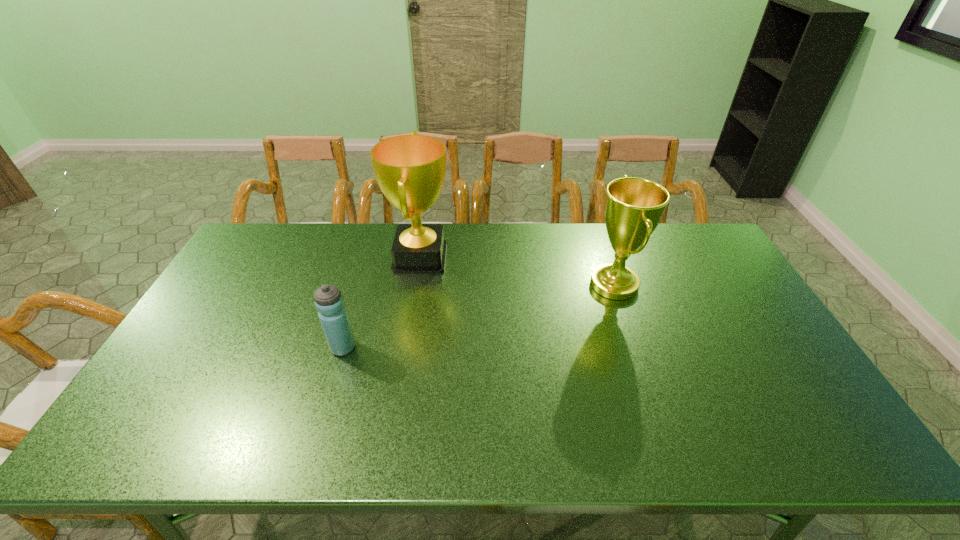
You are a GUI agent. You are given a task and a screenshot of the screen. Output one action in this format:
    pyautogui.click(x=<x>, y=<y>)
    Task: Click on the free space that is in between the shorter award and the nearest object
    
    Given the screenshot: What is the action you would take?
    pyautogui.click(x=478, y=316)

This screenshot has height=540, width=960. Find the location of `free area in between the right award and the leftmost object`. free area in between the right award and the leftmost object is located at coordinates coord(478,316).

The image size is (960, 540). Find the location of `empty space that is in between the water bottle and the shorter award`. empty space that is in between the water bottle and the shorter award is located at coordinates (478, 316).

At what (x,y) coordinates should I click in order to perform the action: click on vacant space in between the leftmost object and the second tallest object. Please return your answer as a coordinate pair (x, y). Looking at the image, I should click on (478, 316).

The image size is (960, 540). What are the coordinates of `blank region between the right award and the shortest object` in the screenshot? It's located at (478, 316).

Identify which object is the second nearest to the shortest object. Please provide its 2D coordinates. Your answer should be formatted as a tuple, i.e. [(x, y)], where the tuple contains the x and y coordinates of a point satisfying the conditions above.

[(634, 206)]

You are a GUI agent. You are given a task and a screenshot of the screen. Output one action in this format:
    pyautogui.click(x=<x>, y=<y>)
    Task: Click on the object that is the second closest to the shorter award
    This screenshot has width=960, height=540.
    Given the screenshot: What is the action you would take?
    pyautogui.click(x=329, y=302)

You are a GUI agent. You are given a task and a screenshot of the screen. Output one action in this format:
    pyautogui.click(x=<x>, y=<y>)
    Task: Click on the free space that satisfies the following two spatial constraints: 1. by the handles of the second tallest object; 2. on the front side of the nearest object
    The height and width of the screenshot is (540, 960).
    Given the screenshot: What is the action you would take?
    pyautogui.click(x=636, y=347)